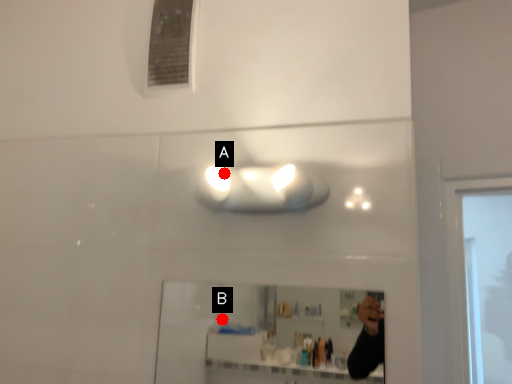
Question: Two points are circled on the image, labeled by A and B beside each circle. Which point is farther to the camera?

Choices:
 (A) A is further
 (B) B is further

Answer: (B)